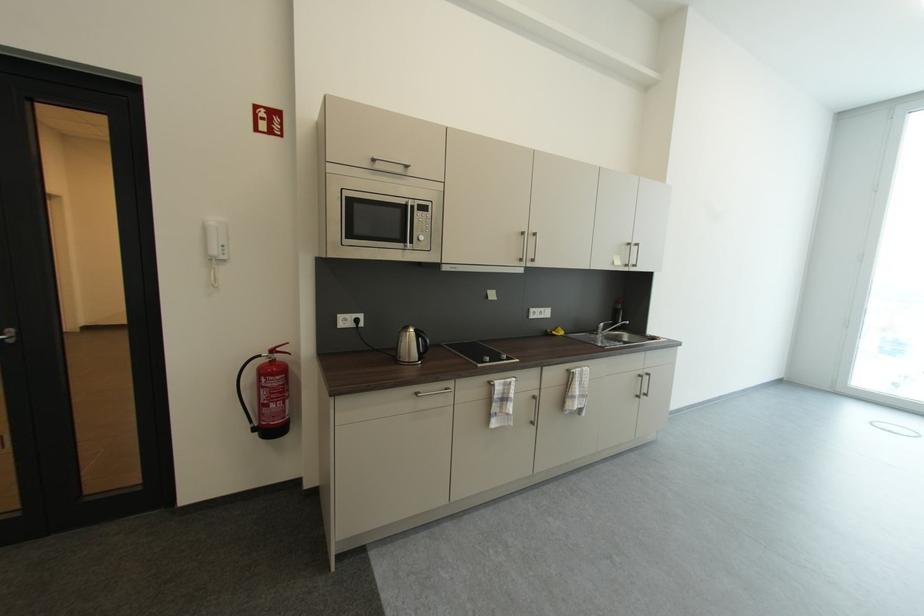
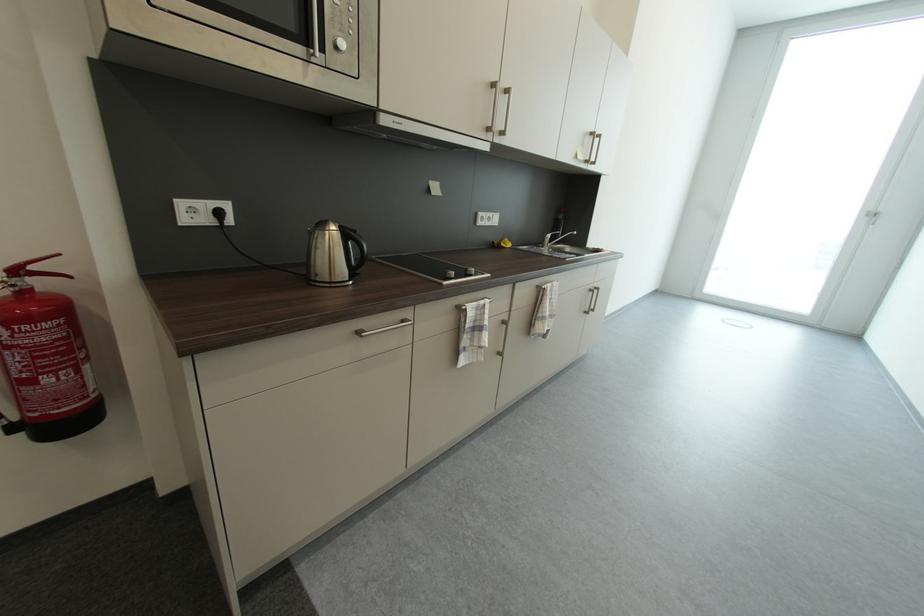
Based on the photo, which direction would the cameraman need to move to produce the second image?

The movement direction of the cameraman is left, forward.